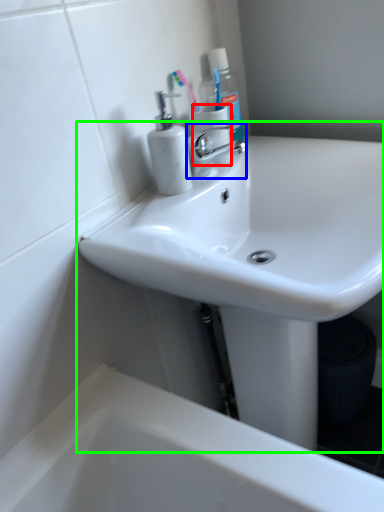
Question: Which is farther away from toilet paper (highlighted by a red box)? tap (highlighted by a blue box) or sink (highlighted by a green box)?

Choices:
 (A) tap
 (B) sink

Answer: (B)